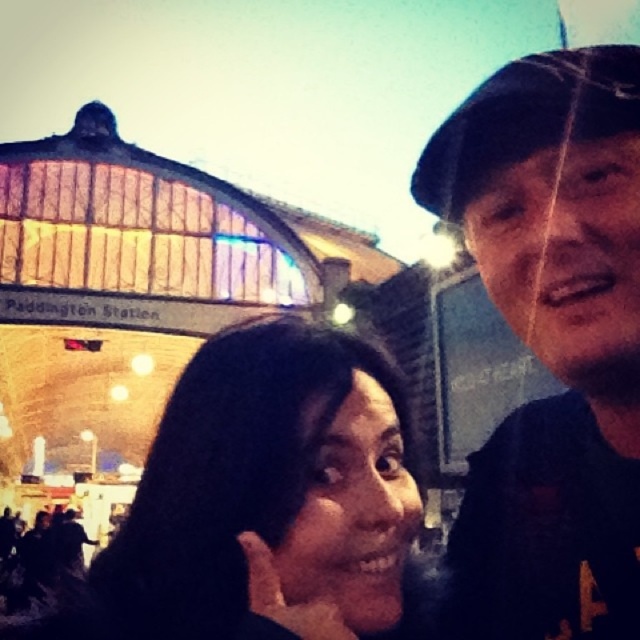
Question: Does black fabric cap at upper right appear over black hair at center?

Choices:
 (A) no
 (B) yes

Answer: (B)

Question: Which object appears closest to the camera in this image?

Choices:
 (A) black fabric cap at upper right
 (B) black hair at center

Answer: (B)

Question: Which of the following is the closest to the observer?

Choices:
 (A) black fabric cap at upper right
 (B) black hair at center

Answer: (B)

Question: Observing the image, what is the correct spatial positioning of black fabric cap at upper right in reference to black hair at center?

Choices:
 (A) above
 (B) below

Answer: (A)

Question: Does black fabric cap at upper right have a larger size compared to black hair at center?

Choices:
 (A) yes
 (B) no

Answer: (A)